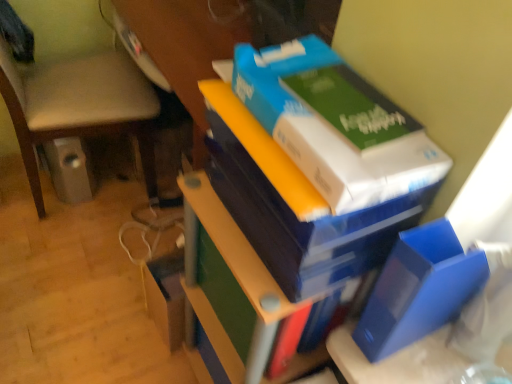
You are a GUI agent. You are given a task and a screenshot of the screen. Output one action in this format:
    pyautogui.click(x=<x>, y=<y>)
    Task: Click on the free space above blue cardboard box at upper right (from a real-world perspective)
    
    Given the screenshot: What is the action you would take?
    [x=340, y=128]